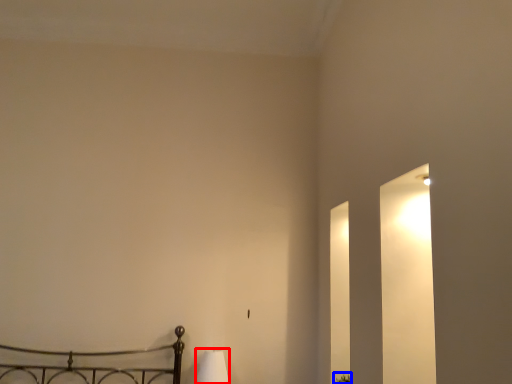
Question: Among these objects, which one is nearest to the camera, lamp (highlighted by a red box) or plant (highlighted by a blue box)?

Choices:
 (A) lamp
 (B) plant

Answer: (B)